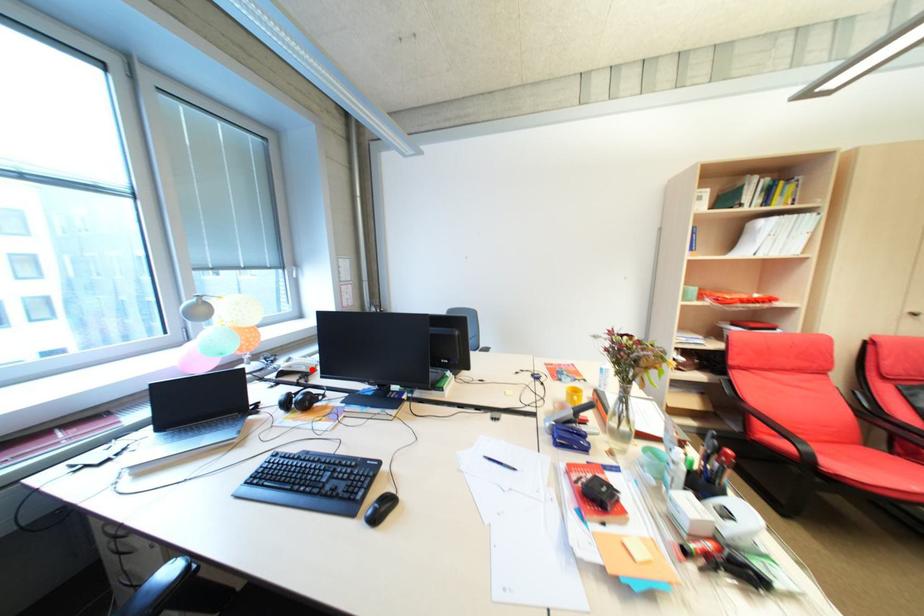
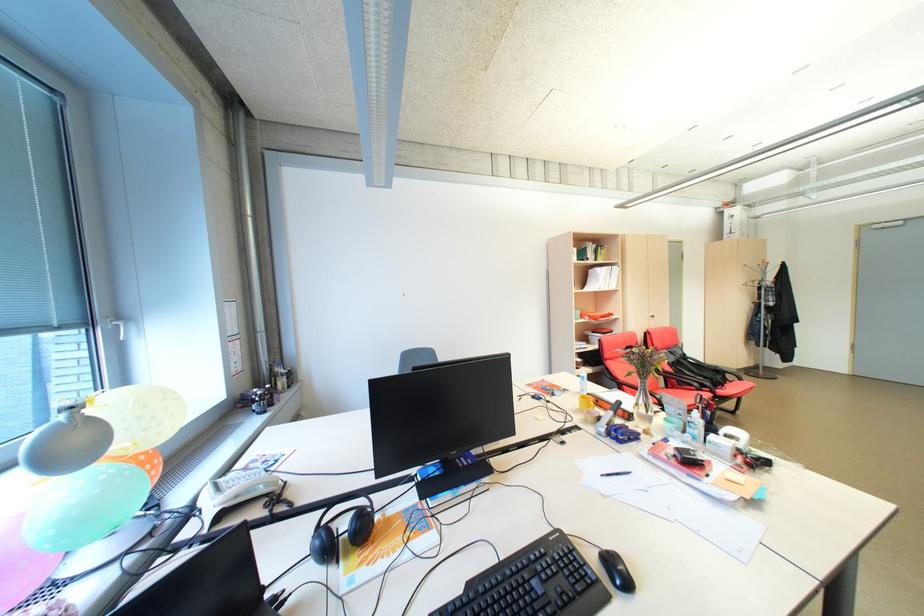
Question: I am providing you with two images of the same scene from different viewpoints. Given a red point in image1, look at the same physical point in image2. Is it:

Choices:
 (A) Closer to the viewpoint
 (B) Farther from the viewpoint

Answer: (A)